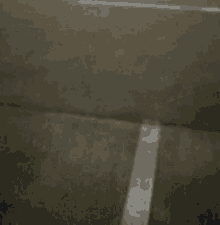
I want to click on white paint, so click(170, 179).